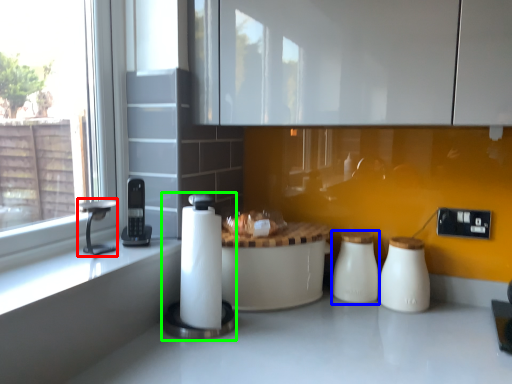
Question: Based on their relative distances, which object is farther from faucet (highlighted by a red box)? Choose from salt shaker (highlighted by a blue box) and appliance (highlighted by a green box).

Choices:
 (A) salt shaker
 (B) appliance

Answer: (A)